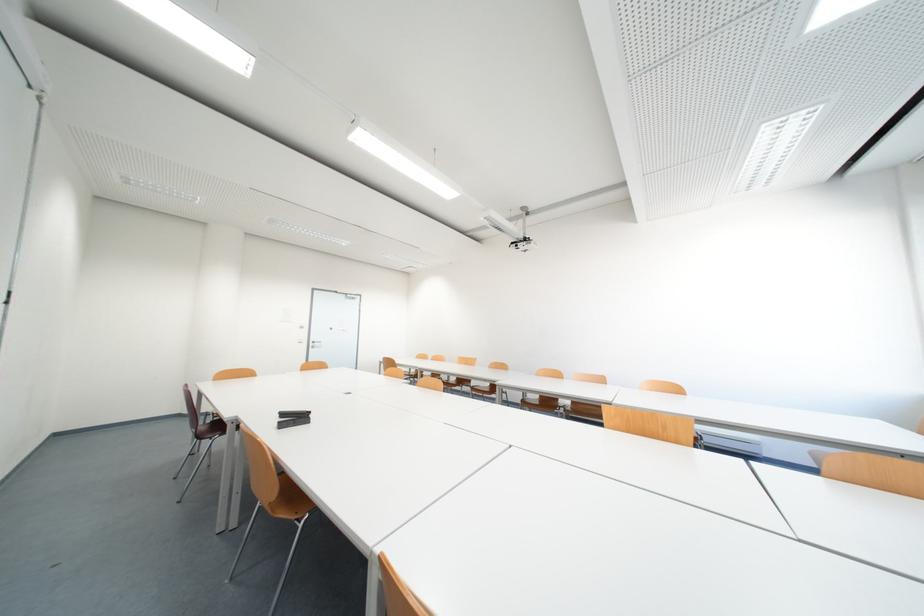
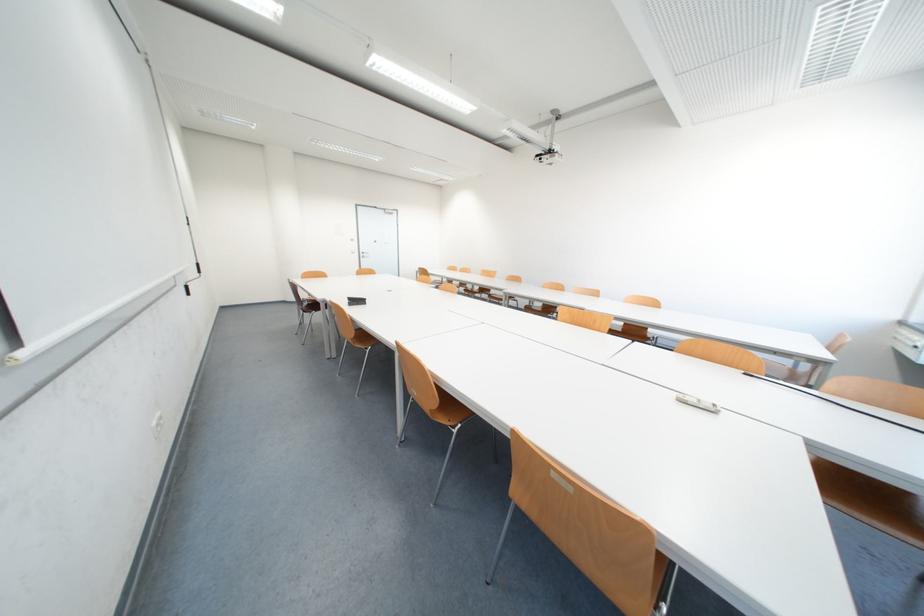
In a continuous first-person perspective shot, in which direction is the camera moving?

The cameraman walked toward right, backward.